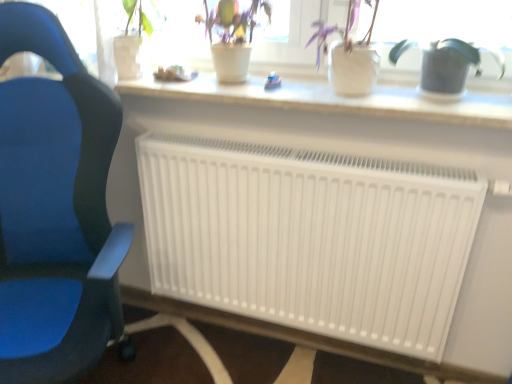
This screenshot has width=512, height=384. In order to click on vacant area situated below white matte radiator at center (from a real-world perspective) in this screenshot , I will do `click(293, 346)`.